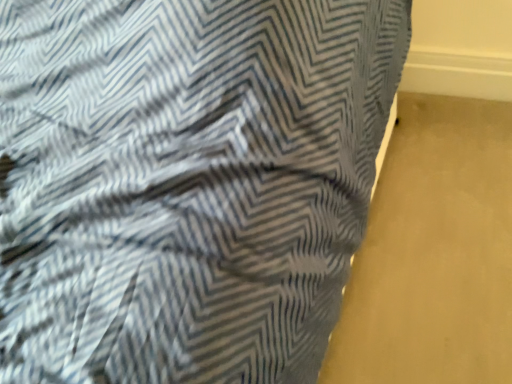
What are the coordinates of `white painted wood at upper right` in the screenshot? It's located at (458, 73).

This screenshot has height=384, width=512. What do you see at coordinates (458, 73) in the screenshot?
I see `white painted wood at upper right` at bounding box center [458, 73].

I want to click on white painted wood at upper right, so click(458, 73).